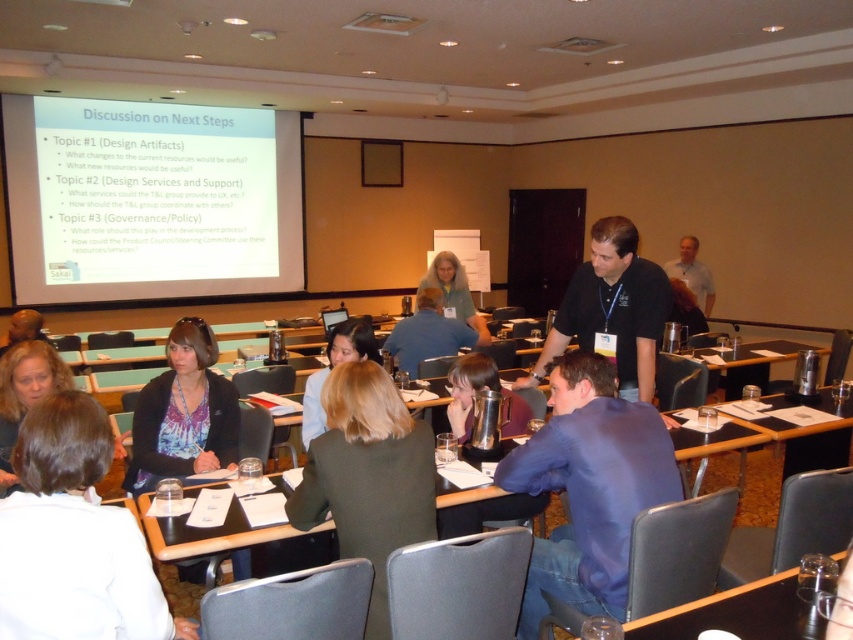
Based on the photo, you are standing in the conference room and want to hand a document to the person wearing the blue shirt at center. If you are currently 10 feet away from them, can you reach them without moving closer?

The blue shirt at center is 6.76 feet away from the viewer, so if you are 10 feet away, you cannot reach them without moving closer.

Based on the photo, you are a presenter standing at the front of the room. You need to adjust the projection focus on the white matte projector screen at upper left. Considering your current position, can you reach the projector controls without moving closer than 20 feet?

The distance between you and the white matte projector screen at upper left is 22.05 feet. Since you need to stay at least 20 feet away, you are within the required distance and can adjust the projector controls from your current position.

You are organizing a meeting and need to place a name tag on the table. The name tag is 10 cm wide. Can the blue shirt at center and the black plastic table at center accommodate the name tag?

The blue shirt at center has a lesser width compared to black plastic table at center. Since the name tag is 10 cm wide, the black plastic table at center can accommodate it, but the blue shirt at center may not have enough space due to its narrower width.